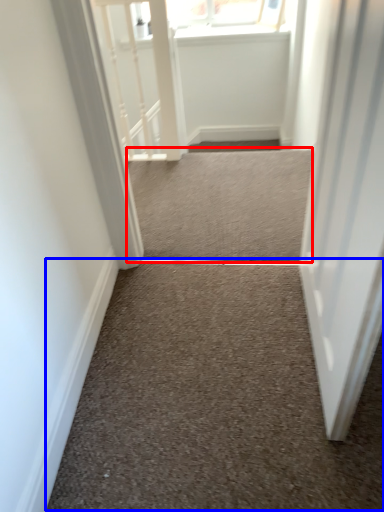
Question: Which point is further to the camera, stairwell (highlighted by a red box) or stairwell (highlighted by a blue box)?

Choices:
 (A) stairwell
 (B) stairwell

Answer: (A)